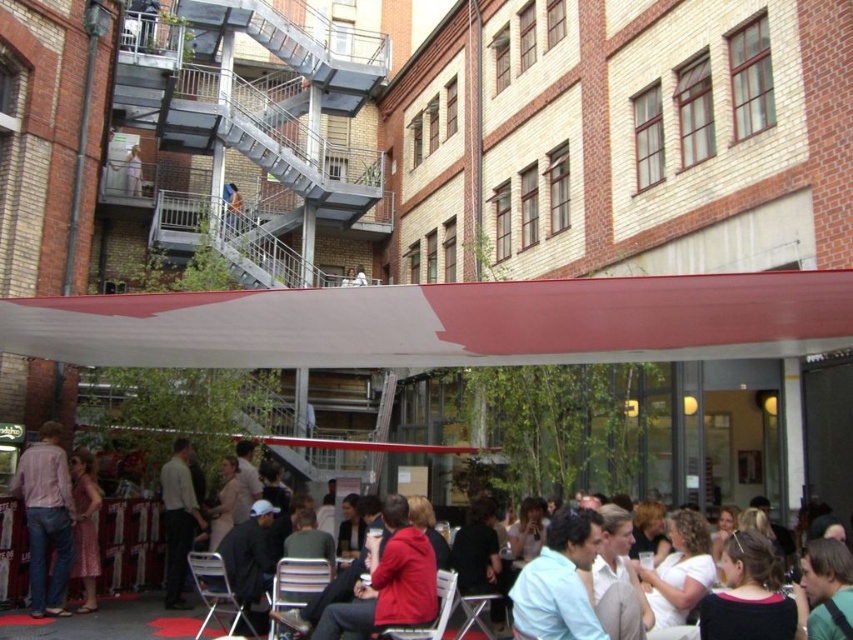
You are a photographer positioned at the center of the courtyard. You want to take a photo that includes both the plaid shirt at lower left and the light brown leather jacket at lower center. Which direction should you pan your camera to ensure both are in frame?

Since the plaid shirt at lower left is to the left of the light brown leather jacket at lower center, you should pan your camera to the left to include both objects in the frame.

You are organizing a small event in this courtyard and need to seat two guests. You have a red fabric chair at center and a plaid shirt at lower left. Which object can accommodate a person to sit?

The red fabric chair at center can accommodate a person to sit because it is larger in size compared to the plaid shirt at lower left, which is not a seating option.